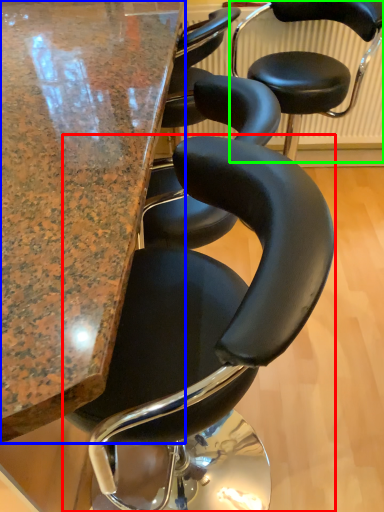
Question: Based on their relative distances, which object is farther from chair (highlighted by a red box)? Choose from table (highlighted by a blue box) and chair (highlighted by a green box).

Choices:
 (A) table
 (B) chair

Answer: (B)